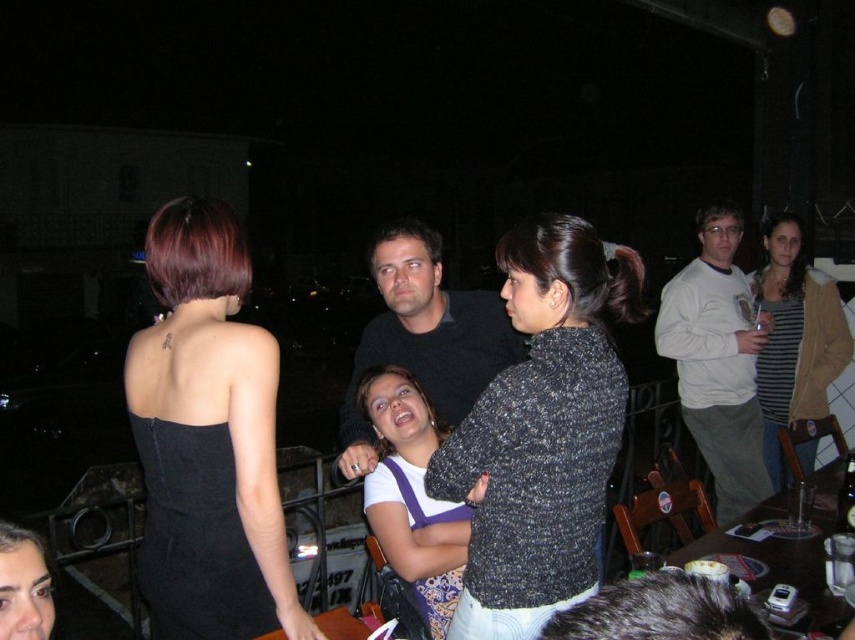
Question: Which point appears farthest from the camera in this image?

Choices:
 (A) (382, 496)
 (B) (579, 337)

Answer: (A)

Question: Is white jersey at center below matte black dress at center?

Choices:
 (A) yes
 (B) no

Answer: (A)

Question: Which object is farther from the camera taking this photo?

Choices:
 (A) white jersey at center
 (B) white sweater at upper right
 (C) speckled sweater at center
 (D) black matte shirt at center

Answer: (B)

Question: In this image, where is black matte dress at upper left located relative to black matte shirt at center?

Choices:
 (A) left
 (B) right

Answer: (A)

Question: Which point is farther to the camera?

Choices:
 (A) (40, 552)
 (B) (401, 337)
 (C) (382, 488)
 (D) (765, 252)

Answer: (D)

Question: Is black matte dress at upper left smaller than matte black dress at center?

Choices:
 (A) no
 (B) yes

Answer: (A)